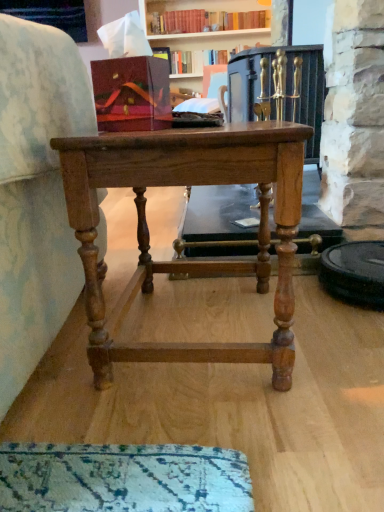
Image resolution: width=384 pixels, height=512 pixels. What do you see at coordinates (195, 58) in the screenshot?
I see `hardcover book at upper center` at bounding box center [195, 58].

What is the approximate width of hardcover book at upper center?

hardcover book at upper center is 6.54 inches wide.

The width and height of the screenshot is (384, 512). Find the location of `matte wood cabinet at upper left`. matte wood cabinet at upper left is located at coordinates (51, 14).

Identify the location of light brown wood table at center. This screenshot has height=512, width=384. (185, 260).

Measure the distance between light brown wood table at center and camera.

60.99 centimeters.

Find the location of a particular element. The width and height of the screenshot is (384, 512). hardcover book at upper center is located at coordinates (195, 58).

Does matte wood cabinet at upper left have a larger size compared to hardcover book at upper center?

Indeed, matte wood cabinet at upper left has a larger size compared to hardcover book at upper center.

From a real-world perspective, is matte wood cabinet at upper left positioned above or below hardcover book at upper center?

In terms of real-world spatial position, matte wood cabinet at upper left is above hardcover book at upper center.

Is light brown wood table at center not close to hardcover book at upper center?

That's right, there is a large distance between light brown wood table at center and hardcover book at upper center.

Which of these two, light brown wood table at center or hardcover book at upper center, is thinner?

Thinner between the two is hardcover book at upper center.

Considering the sizes of objects light brown wood table at center and hardcover book at upper center in the image provided, who is taller, light brown wood table at center or hardcover book at upper center?

light brown wood table at center is taller.

Is light brown wood table at center not within hardcover book at upper center?

Yes, light brown wood table at center is outside of hardcover book at upper center.

Is point (129, 167) positioned before point (18, 8)?

Yes, point (129, 167) is closer to viewer.

Is light brown wood table at center oriented towards matte wood cabinet at upper left?

No.

Looking at their sizes, would you say light brown wood table at center is wider or thinner than matte wood cabinet at upper left?

Considering their sizes, light brown wood table at center looks broader than matte wood cabinet at upper left.

Which of these two, light brown wood table at center or matte wood cabinet at upper left, is bigger?

Bigger between the two is light brown wood table at center.

Locate an element on the screen. cabinetry above the light brown wood table at center (from a real-world perspective) is located at coordinates (51, 14).

Consider the image. Would you consider matte wood cabinet at upper left to be distant from light brown wood table at center?

Yes.

Considering the sizes of objects matte wood cabinet at upper left and light brown wood table at center in the image provided, who is thinner, matte wood cabinet at upper left or light brown wood table at center?

matte wood cabinet at upper left.

Is point (29, 6) more distant than point (129, 170)?

Yes, it is behind point (129, 170).

From the image's perspective, is hardcover book at upper center positioned above or below matte wood cabinet at upper left?

hardcover book at upper center is below matte wood cabinet at upper left.

Is hardcover book at upper center taller or shorter than matte wood cabinet at upper left?

hardcover book at upper center is shorter than matte wood cabinet at upper left.

In the scene shown: Are hardcover book at upper center and matte wood cabinet at upper left making contact?

hardcover book at upper center is not next to matte wood cabinet at upper left, and they're not touching.

Which object is thinner, hardcover book at upper center or matte wood cabinet at upper left?

Thinner between the two is matte wood cabinet at upper left.

Between hardcover book at upper center and light brown wood table at center, which one has larger width?

light brown wood table at center is wider.

Can you confirm if hardcover book at upper center is shorter than light brown wood table at center?

Indeed, hardcover book at upper center has a lesser height compared to light brown wood table at center.

Would you say light brown wood table at center is part of hardcover book at upper center's contents?

No, light brown wood table at center is not inside hardcover book at upper center.

Which object is closer to the camera, hardcover book at upper center or light brown wood table at center?

light brown wood table at center.

Where is `cabinetry to the left of hardcover book at upper center`? The image size is (384, 512). cabinetry to the left of hardcover book at upper center is located at coordinates (51, 14).

Locate an element on the screen. book above the light brown wood table at center (from a real-world perspective) is located at coordinates (195, 58).

When comparing their distances from matte wood cabinet at upper left, does light brown wood table at center or hardcover book at upper center seem further?

Based on the image, light brown wood table at center appears to be further to matte wood cabinet at upper left.

From the image, which object appears to be farther from matte wood cabinet at upper left, hardcover book at upper center or light brown wood table at center?

light brown wood table at center is positioned further to the anchor matte wood cabinet at upper left.

From the image, which object appears to be nearer to light brown wood table at center, hardcover book at upper center or matte wood cabinet at upper left?

The object closer to light brown wood table at center is hardcover book at upper center.

When comparing their distances from hardcover book at upper center, does matte wood cabinet at upper left or light brown wood table at center seem closer?

matte wood cabinet at upper left.

Estimate the real-world distances between objects in this image. Which object is further from light brown wood table at center, matte wood cabinet at upper left or hardcover book at upper center?

matte wood cabinet at upper left lies further to light brown wood table at center than the other object.

Looking at the image, which one is located further to hardcover book at upper center, light brown wood table at center or matte wood cabinet at upper left?

light brown wood table at center is positioned further to the anchor hardcover book at upper center.

Where is `cabinetry positioned between light brown wood table at center and hardcover book at upper center from near to far`? This screenshot has width=384, height=512. cabinetry positioned between light brown wood table at center and hardcover book at upper center from near to far is located at coordinates point(51,14).